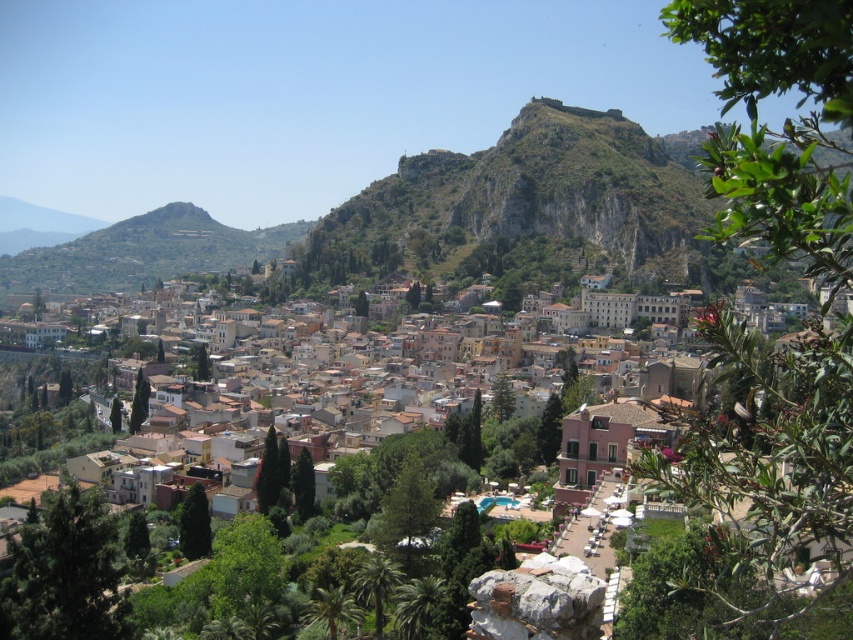
You are a hiker planning to climb the green rocky hill at center and the green grassy hillside at center. Based on the scene description, which hill would require more effort to climb?

The green rocky hill at center requires more effort to climb because it has a greater height compared to the green grassy hillside at center.

You are standing in the town square and want to take a photo of the green rocky hill at center and the green grassy hillside at center. Which hill should you focus on first to ensure both are in the frame?

You should focus on the green rocky hill at center first because it is in front of the green grassy hillside at center, so capturing it first will help ensure both are visible in the frame.